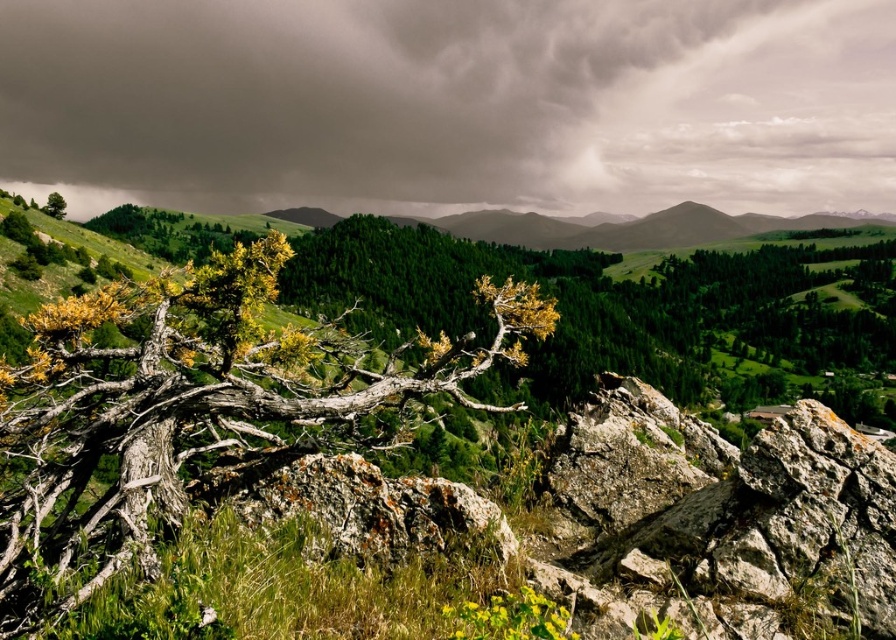
You are an observer looking at the landscape. You notice the dark gray cloud at upper center and the green leafy tree at upper left. Which object is positioned higher in the sky?

The dark gray cloud at upper center is positioned higher in the sky than the green leafy tree at upper left.

You are a hiker standing at the base of the rusty rock at center and want to reach the green leafy tree at upper left. Which direction should you head to get closer to the tree?

The green leafy tree at upper left is taller than the rusty rock at center, so you should head towards the upper left direction to get closer to the tree.